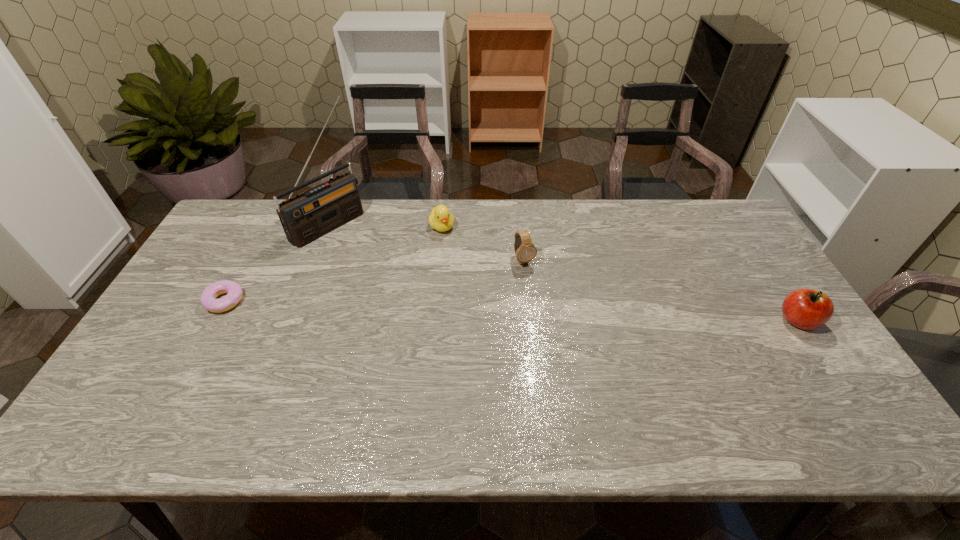
This screenshot has height=540, width=960. Identify the location of free space on the desktop that is between the leftmost object and the apple and is positioned on the beak of the duckling. (480, 309).

Find the location of a particular element. The image size is (960, 540). free space on the desktop that is between the doughnut and the apple and is positioned on the front-facing side of the second object from left to right is located at coordinates (443, 308).

Identify the location of free space on the desktop that is between the doughnut and the rightmost object and is positioned on the face of the third farthest object. Image resolution: width=960 pixels, height=540 pixels. (552, 312).